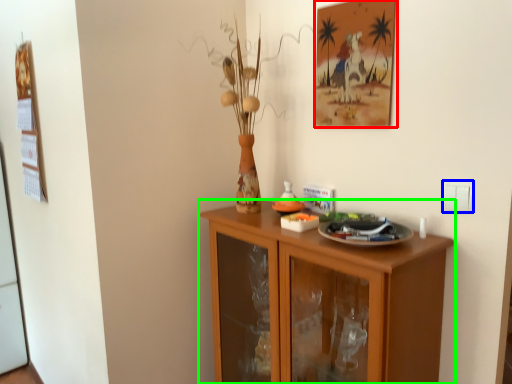
Question: Based on their relative distances, which object is nearer to picture frame (highlighted by a red box)? Choose from electric outlet (highlighted by a blue box) and cabinetry (highlighted by a green box).

Choices:
 (A) electric outlet
 (B) cabinetry

Answer: (A)